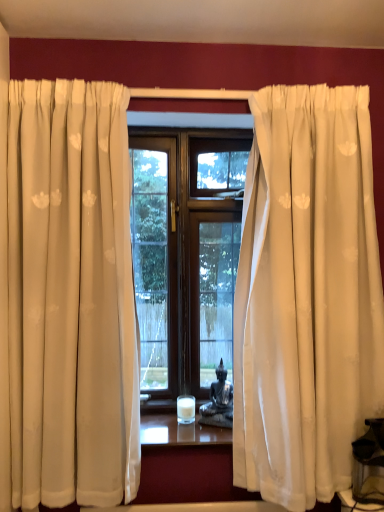
The width and height of the screenshot is (384, 512). Identify the location of empty space that is to the right of white wax candle at center. (215, 428).